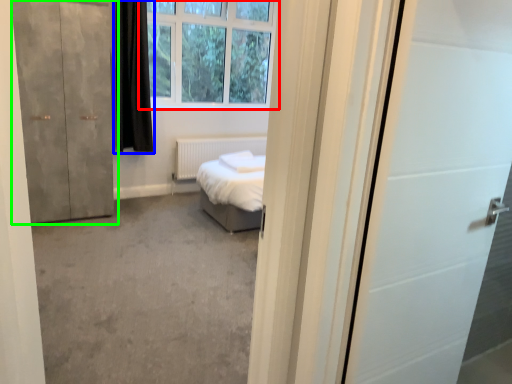
Question: Which object is positioned closest to window (highlighted by a red box)? Select from curtain (highlighted by a blue box) and door (highlighted by a green box).

Choices:
 (A) curtain
 (B) door

Answer: (A)